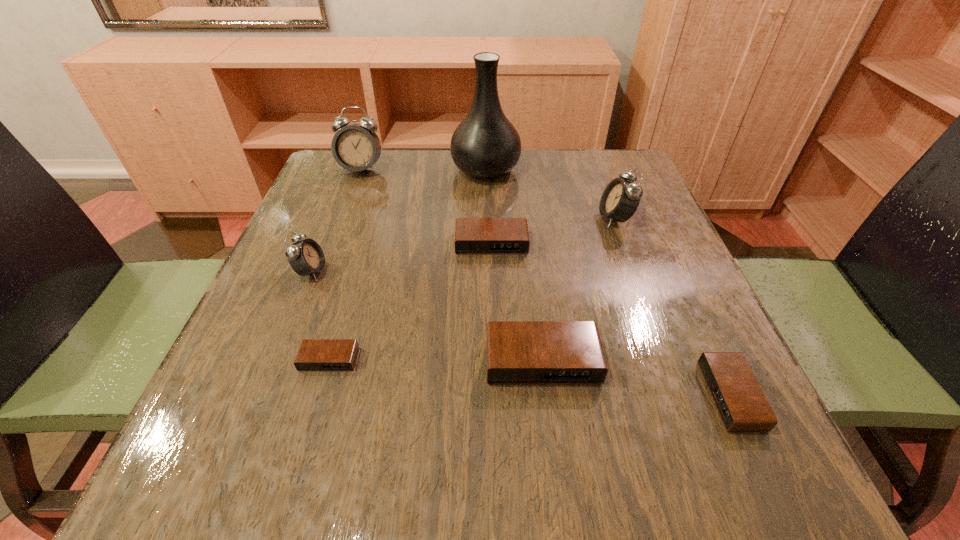
Identify which alarm clock is the second nearest to the tallest object. Please provide its 2D coordinates. Your answer should be formatted as a tuple, i.e. [(x, y)], where the tuple contains the x and y coordinates of a point satisfying the conditions above.

[(356, 147)]

You are a GUI agent. You are given a task and a screenshot of the screen. Output one action in this format:
    pyautogui.click(x=<x>, y=<y>)
    Task: Click on the white alarm clock that is the closest to the second biggest black alarm clock
    The image size is (960, 540).
    Given the screenshot: What is the action you would take?
    pyautogui.click(x=620, y=199)

Select which white alarm clock is the second closest to the farthest alarm clock. Please provide its 2D coordinates. Your answer should be formatted as a tuple, i.e. [(x, y)], where the tuple contains the x and y coordinates of a point satisfying the conditions above.

[(620, 199)]

Where is `black alarm clock that is the third closest to the farthest black alarm clock`? The height and width of the screenshot is (540, 960). black alarm clock that is the third closest to the farthest black alarm clock is located at coordinates pos(742,406).

Point out which black alarm clock is positioned as the second nearest to the fourth farthest alarm clock. Please provide its 2D coordinates. Your answer should be formatted as a tuple, i.e. [(x, y)], where the tuple contains the x and y coordinates of a point satisfying the conditions above.

[(473, 236)]

You are a GUI agent. You are given a task and a screenshot of the screen. Output one action in this format:
    pyautogui.click(x=<x>, y=<y>)
    Task: Click on the blank space that satisfies the following two spatial constraints: 1. on the front face of the third shortest object; 2. on the face of the smallest white alarm clock
    The image size is (960, 540).
    Given the screenshot: What is the action you would take?
    pyautogui.click(x=492, y=272)

The image size is (960, 540). I want to click on vacant space that satisfies the following two spatial constraints: 1. on the face of the farthest alarm clock; 2. on the face of the third tallest alarm clock, so click(324, 272).

Image resolution: width=960 pixels, height=540 pixels. Identify the location of vacant position in the image that satisfies the following two spatial constraints: 1. on the face of the second object from right to left; 2. on the front face of the fifth tallest object. (667, 361).